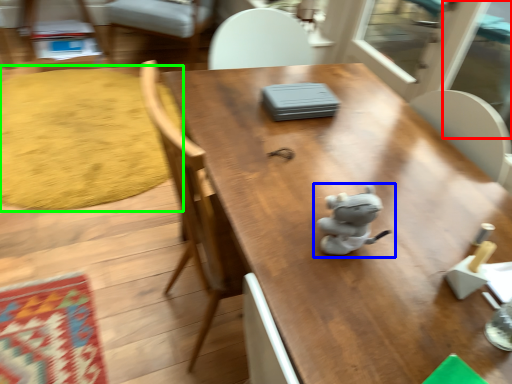
Question: Which object is the closest to the screen door (highlighted by a red box)? Choose among these: toy (highlighted by a blue box) or mat (highlighted by a green box).

Choices:
 (A) toy
 (B) mat

Answer: (B)